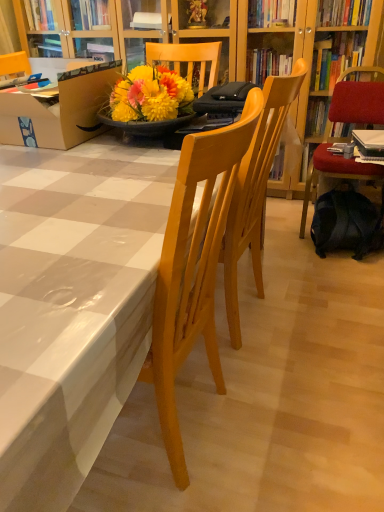
Identify the location of free space above black fabric backpack at lower right (from a real-world perspective). (350, 201).